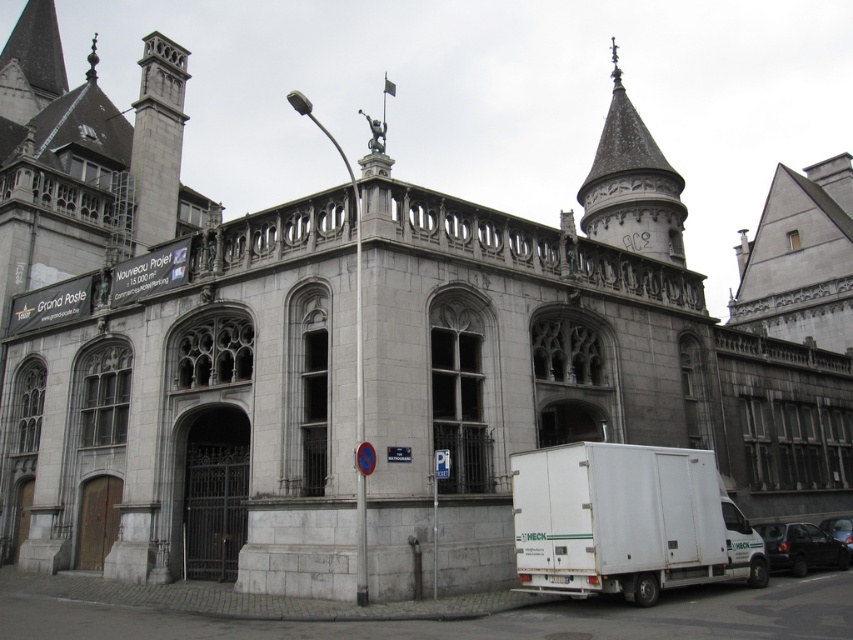
You are standing on the sidewalk in front of the historic building and want to take a photo of the gray stone spire at upper right and the black matte van at lower right. Which object will appear closer to you in the photo?

The gray stone spire at upper right will appear closer in the photo because it is positioned closer to the viewer than the black matte van at lower right.